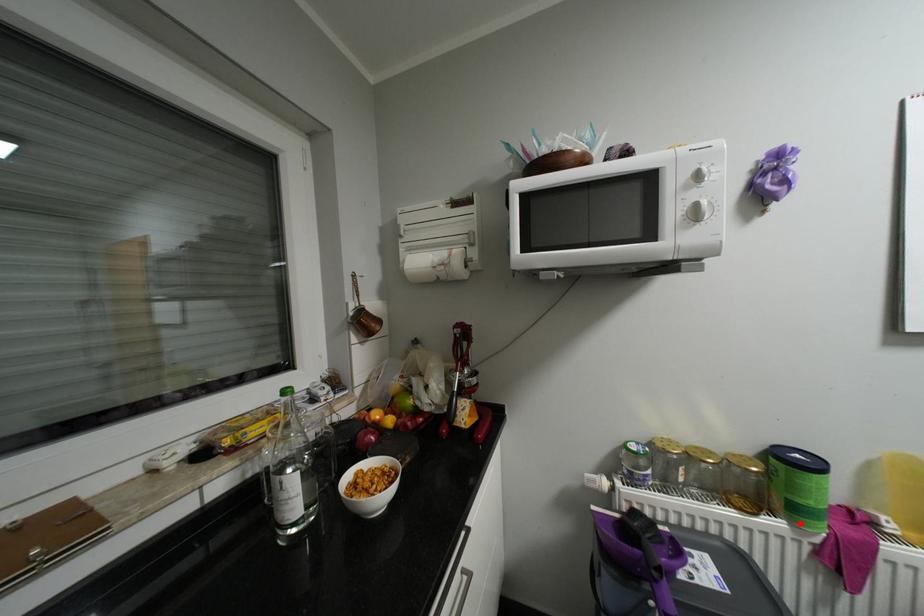
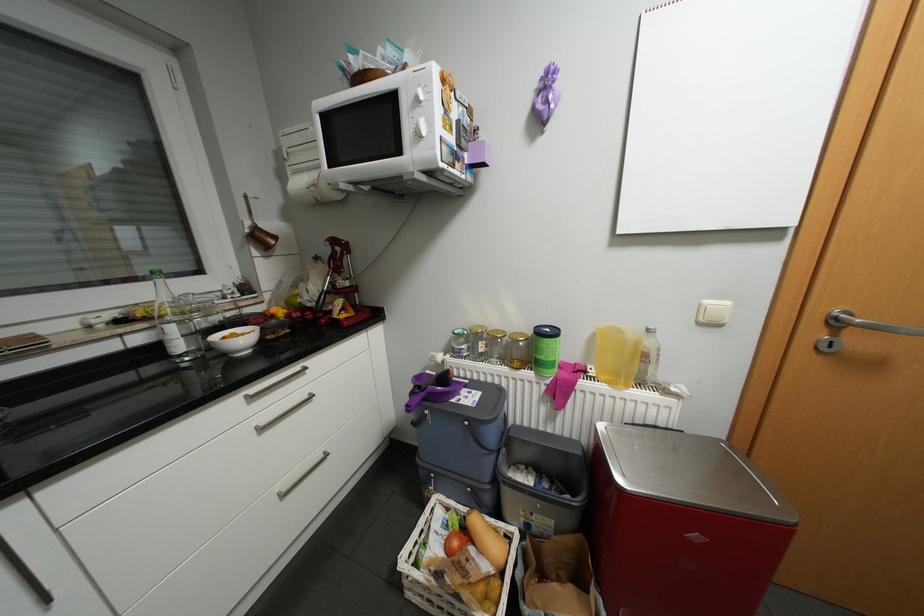
Where in the second image is the point corresponding to the highlighted location from the first image?

(544, 373)